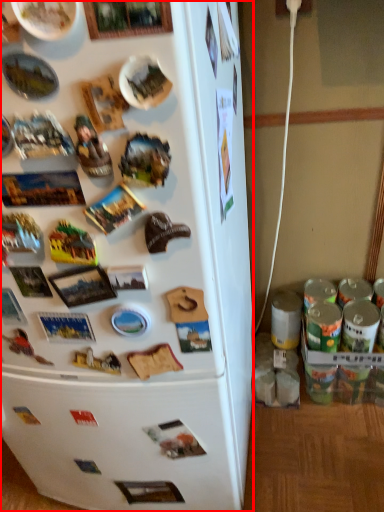
Question: From the image's perspective, where is refrigerator (annotated by the red box) located relative to toy?

Choices:
 (A) below
 (B) above

Answer: (A)